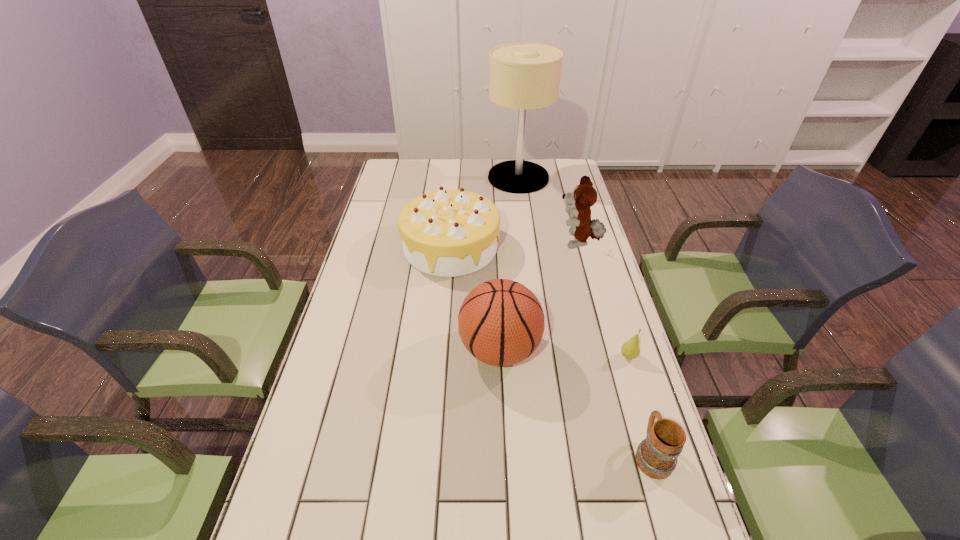
Locate an element on the screen. The width and height of the screenshot is (960, 540). free space located 0.280m on the face of the puppy is located at coordinates (480, 244).

Locate an element on the screen. The width and height of the screenshot is (960, 540). vacant area located 0.210m on the face of the puppy is located at coordinates (499, 244).

In order to click on blank space located 0.260m on the side where the inflation valve is located in this screenshot , I will do `click(368, 350)`.

The width and height of the screenshot is (960, 540). I want to click on free space located 0.330m on the side where the inflation valve is located, so click(x=343, y=350).

This screenshot has height=540, width=960. In order to click on free location located 0.280m on the side where the inflation valve is located in this screenshot , I will do `click(361, 350)`.

You are a GUI agent. You are given a task and a screenshot of the screen. Output one action in this format:
    pyautogui.click(x=<x>, y=<y>)
    Task: Click on the vacant region located on the left of the birthday cake
    
    Given the screenshot: What is the action you would take?
    pyautogui.click(x=359, y=247)

Locate an element on the screen. The image size is (960, 540). vacant space located on the side of the mug with the handle is located at coordinates (613, 328).

The height and width of the screenshot is (540, 960). Find the location of `vacant space situated on the side of the mug with the handle`. vacant space situated on the side of the mug with the handle is located at coordinates (636, 405).

At what (x,y) coordinates should I click in order to perform the action: click on free region located on the side of the mug with the handle. Please return your answer as a coordinate pair (x, y). Image resolution: width=960 pixels, height=540 pixels. Looking at the image, I should click on (630, 382).

Locate an element on the screen. The image size is (960, 540). vacant space positioned 0.330m on the front of the pear is located at coordinates (668, 485).